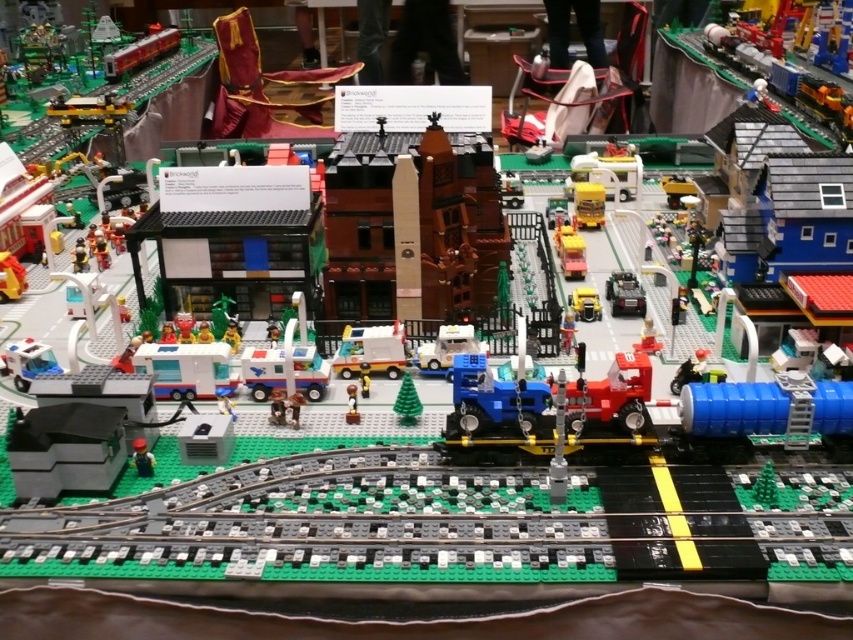
You are a delivery driver in the Lego city who needs to transport a large package. The package requires a vehicle that can carry it. Which vehicle between the metallic red train at upper left and the yellow matte truck at center would be more suitable for this task?

The metallic red train at upper left is larger in size than the yellow matte truck at center, making it more suitable for carrying large packages.

You are standing at the point marked as point (396, 376) in the Lego cityscape. You want to place a new Lego tree that is 4 feet tall. Will the tree fit vertically without exceeding the height of the Lego structures around it?

The point (396, 376) is 3.98 feet away from the viewer. Since the tree is 4 feet tall, it might exceed the height of surrounding Lego structures if placed there. Check the nearby buildings for height compatibility.